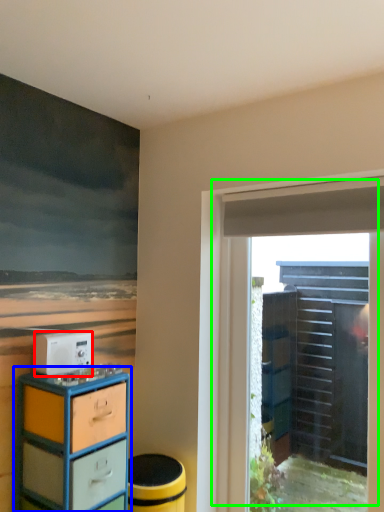
Question: Considering the real-world distances, which object is farthest from appliance (highlighted by a red box)? chest of drawers (highlighted by a blue box) or door (highlighted by a green box)?

Choices:
 (A) chest of drawers
 (B) door

Answer: (B)